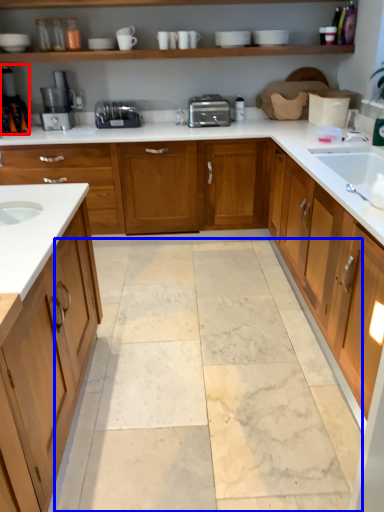
Question: Which point is closer to the camera, coffee machine (highlighted by a red box) or granite (highlighted by a blue box)?

Choices:
 (A) coffee machine
 (B) granite

Answer: (B)